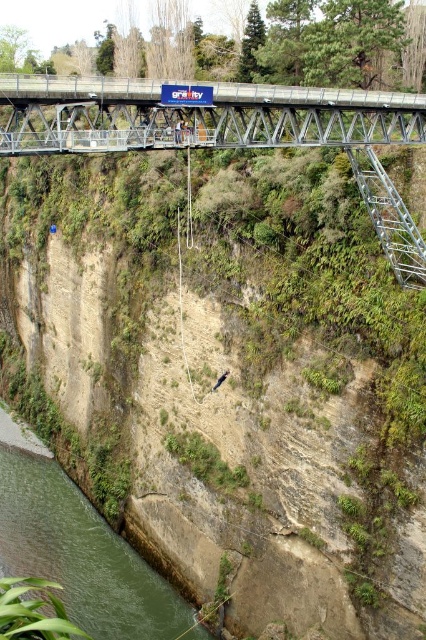
Between point (158, 138) and point (396, 189), which one is positioned behind?

Point (396, 189)

Between metallic gray bridge at upper center and metallic silver ladder at right, which one has more height?

With more height is metallic gray bridge at upper center.

Is point (414, 97) less distant than point (409, 244)?

That is False.

Locate an element on the screen. metallic gray bridge at upper center is located at coordinates (195, 115).

Does green concrete river at lower left appear on the left side of metallic silver ladder at right?

Yes, green concrete river at lower left is to the left of metallic silver ladder at right.

Does point (95, 544) come farther from viewer compared to point (411, 227)?

Yes, point (95, 544) is behind point (411, 227).

Who is more forward, [19,488] or [371,202]?

Point [371,202]

I want to click on green concrete river at lower left, so click(77, 548).

Which is more to the right, metallic gray bridge at upper center or green concrete river at lower left?

metallic gray bridge at upper center

How far apart are metallic gray bridge at upper center and green concrete river at lower left?

metallic gray bridge at upper center and green concrete river at lower left are 26.90 meters apart from each other.

In order to click on metallic gray bridge at upper center in this screenshot , I will do `click(195, 115)`.